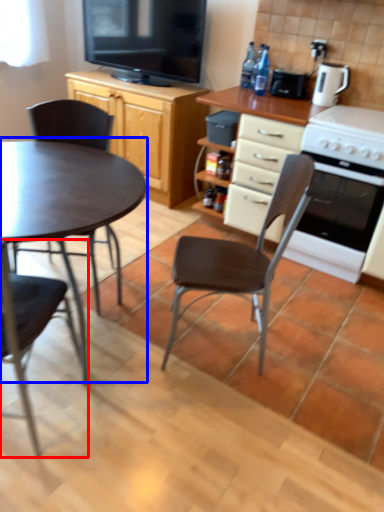
Question: Which object appears farthest to the camera in this image, chair (highlighted by a red box) or coffee table (highlighted by a blue box)?

Choices:
 (A) chair
 (B) coffee table

Answer: (B)